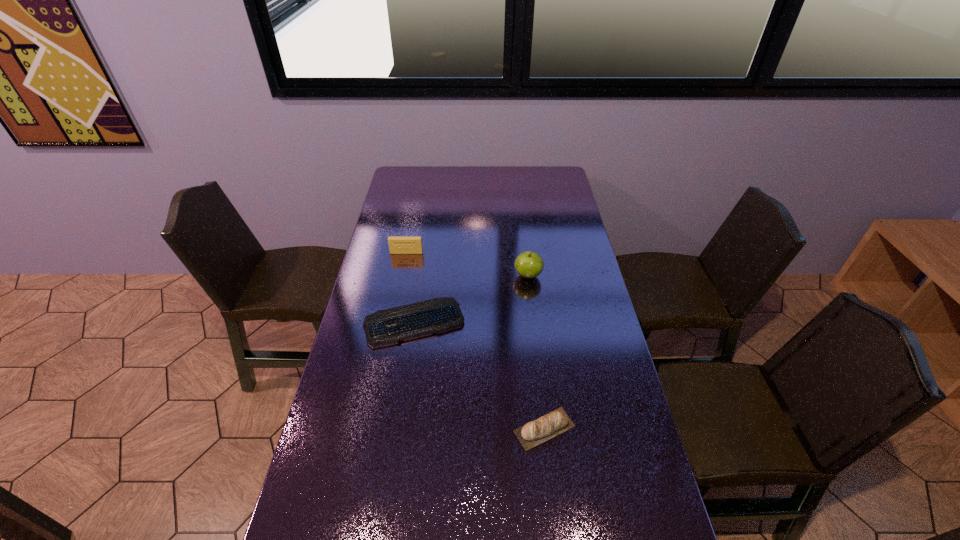
The image size is (960, 540). Find the location of `vacant region located on the back of the third tallest object`. vacant region located on the back of the third tallest object is located at coordinates (534, 340).

The image size is (960, 540). In order to click on vacant space located on the right of the shortest object in this screenshot , I will do `click(574, 322)`.

At what (x,y) coordinates should I click in order to perform the action: click on videotape located in the left edge section of the desktop. Please return your answer as a coordinate pair (x, y). This screenshot has height=540, width=960. Looking at the image, I should click on (397, 245).

Locate an element on the screen. The width and height of the screenshot is (960, 540). computer keyboard that is at the left edge is located at coordinates (384, 327).

Where is `object located at the right edge`? object located at the right edge is located at coordinates (556, 422).

Locate an element on the screen. This screenshot has width=960, height=540. vacant space at the far edge of the desktop is located at coordinates (503, 177).

In the image, there is a desktop. Where is `vacant area at the left edge`? vacant area at the left edge is located at coordinates (394, 301).

Locate an element on the screen. The image size is (960, 540). free space at the right edge of the desktop is located at coordinates (632, 468).

What are the coordinates of `free space at the far left corner of the desktop` in the screenshot? It's located at (416, 167).

The height and width of the screenshot is (540, 960). Find the location of `free point between the second shortest object and the videotape`. free point between the second shortest object and the videotape is located at coordinates (475, 341).